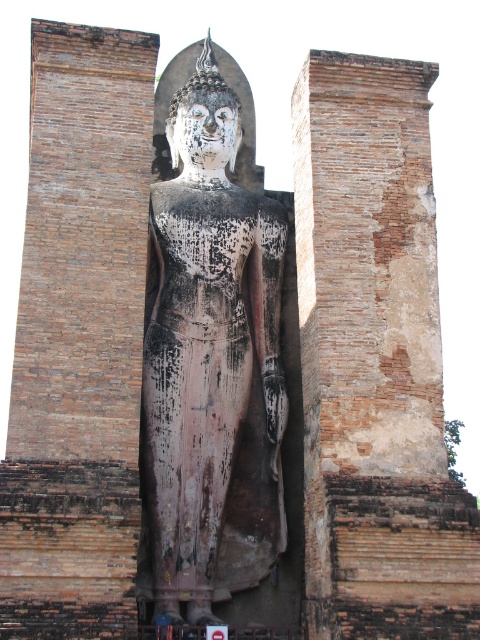
Is brown textured stone pillar at center bigger than blackened stone statue at center?

No, brown textured stone pillar at center is not bigger than blackened stone statue at center.

How far apart are brown textured stone pillar at center and blackened stone statue at center?

brown textured stone pillar at center and blackened stone statue at center are 8.04 meters apart.

What are the coordinates of `brown textured stone pillar at center` in the screenshot? It's located at (374, 360).